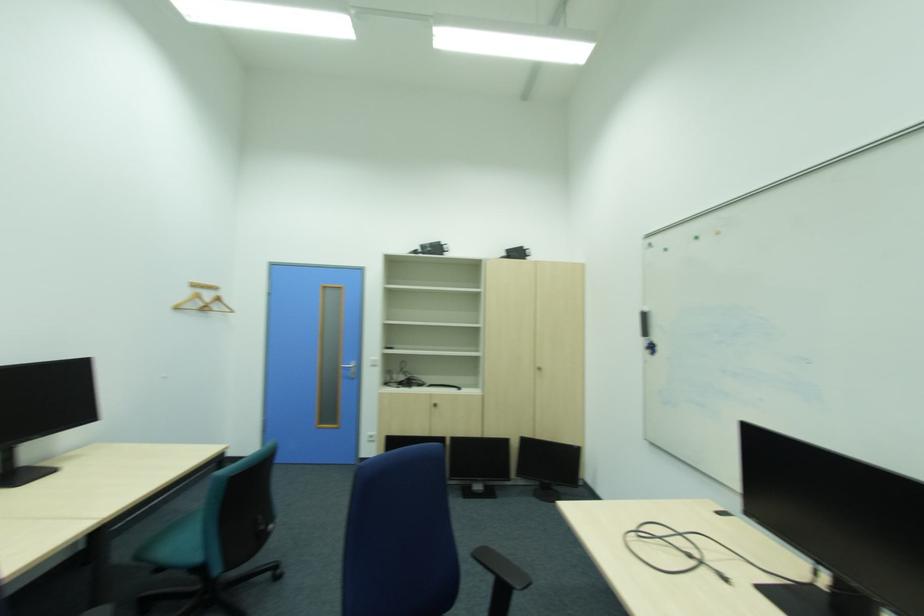
Which object does [191,302] point to?

This point indicates the wooden coat hanger.